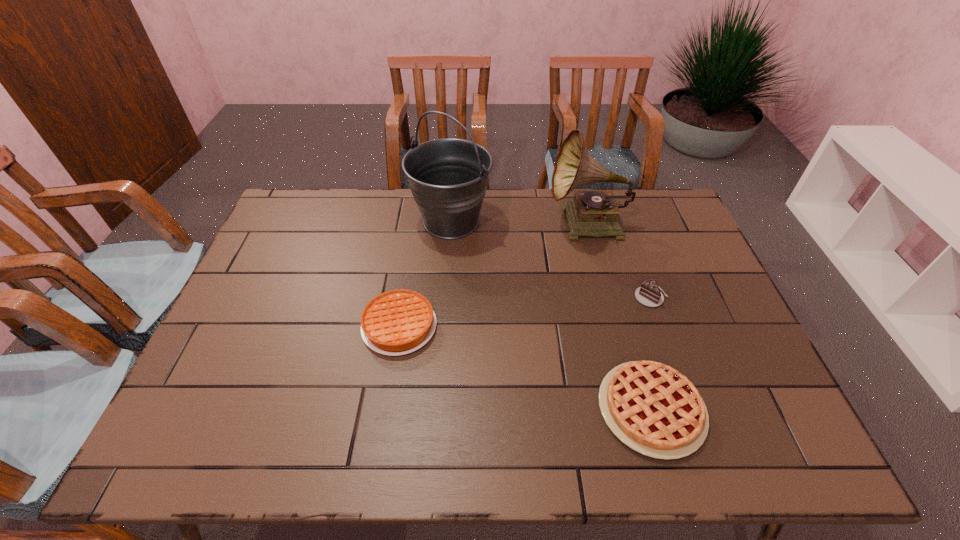
This screenshot has height=540, width=960. In the image, there is a desktop. Identify the location of free space at the right edge. (678, 314).

The width and height of the screenshot is (960, 540). What are the coordinates of `vacant region at the far left corner of the desktop` in the screenshot? It's located at (319, 225).

You are a GUI agent. You are given a task and a screenshot of the screen. Output one action in this format:
    pyautogui.click(x=<x>, y=<y>)
    Task: Click on the free space between the bucket and the chocolate cake
    The image size is (960, 540).
    Given the screenshot: What is the action you would take?
    pyautogui.click(x=551, y=259)

Find the location of a particular element. The image size is (960, 540). vacant space that is in between the farther pie and the nearer pie is located at coordinates (525, 368).

Locate an element on the screen. free space between the bucket and the left pie is located at coordinates (425, 274).

I want to click on vacant space in between the right pie and the left pie, so pyautogui.click(x=525, y=368).

Find the location of a particular element. vacant space that's between the left pie and the chocolate cake is located at coordinates (525, 312).

The width and height of the screenshot is (960, 540). In order to click on free space between the farther pie and the record player in this screenshot , I will do `click(493, 276)`.

This screenshot has width=960, height=540. Identify the location of vacant space that is in between the chocolate cake and the left pie. (525, 312).

This screenshot has width=960, height=540. What are the coordinates of `vacant space that's between the nearest object and the bucket` in the screenshot? It's located at (551, 315).